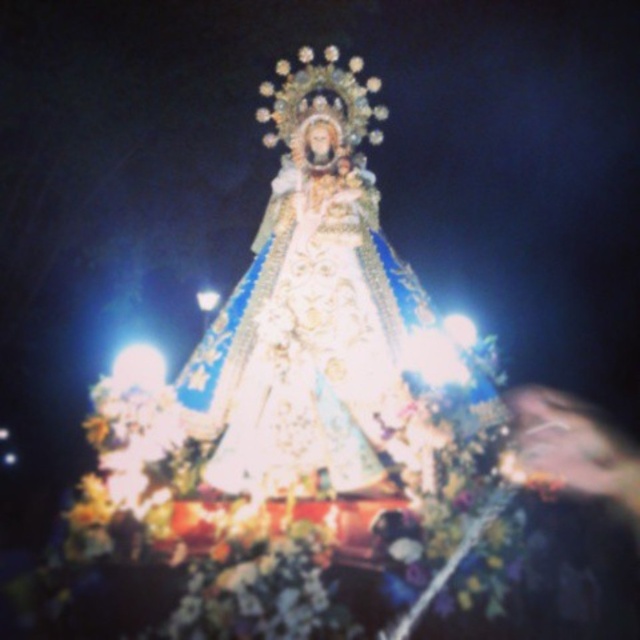
You are attending a formal event and want to know which item in the scene is bigger between the white satin dress at center and the smooth skin face at lower right. Can you tell me?

The white satin dress at center has a larger size compared to the smooth skin face at lower right, so the white satin dress at center is bigger.

You are a photographer standing in front of the statue. You notice the white satin dress at center and the smooth skin face at lower right. Which object is located more to the left in the scene?

The white satin dress at center is positioned on the left side of smooth skin face at lower right, so it is more to the left.

You are a photographer at the event and want to capture a clear shot of both the white satin dress at center and the smooth skin face at lower right. However, your camera can only focus on one subject at a time. Which subject should you focus on to ensure the other is still in the background?

You should focus on the white satin dress at center because it is positioned over the smooth skin face at lower right, meaning the face will naturally be in the background if the dress is in focus.